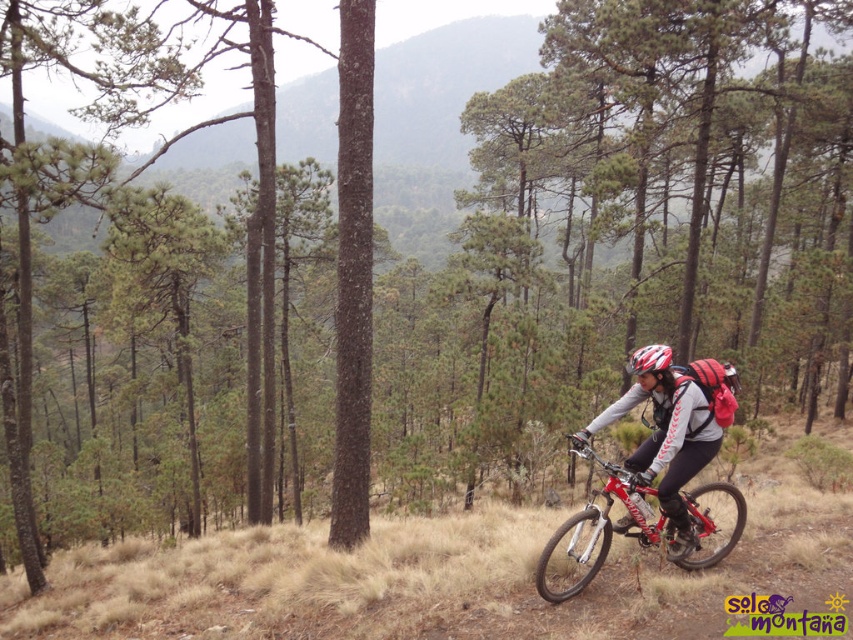
Question: Which of the following is the farthest from the observer?

Choices:
 (A) (637, 524)
 (B) (660, 364)

Answer: (A)

Question: Can you confirm if matte black helmet at center is positioned to the left of shiny metallic bicycle at right?

Choices:
 (A) no
 (B) yes

Answer: (B)

Question: Does shiny metallic bicycle at right appear on the right side of matte white helmet at center?

Choices:
 (A) yes
 (B) no

Answer: (A)

Question: Which of the following is the farthest from the observer?

Choices:
 (A) (711, 365)
 (B) (573, 577)

Answer: (B)

Question: Which is nearer to the matte black helmet at center?

Choices:
 (A) matte white helmet at center
 (B) shiny metallic bicycle at right

Answer: (A)

Question: Is matte black helmet at center further to the viewer compared to shiny metallic bicycle at right?

Choices:
 (A) no
 (B) yes

Answer: (B)